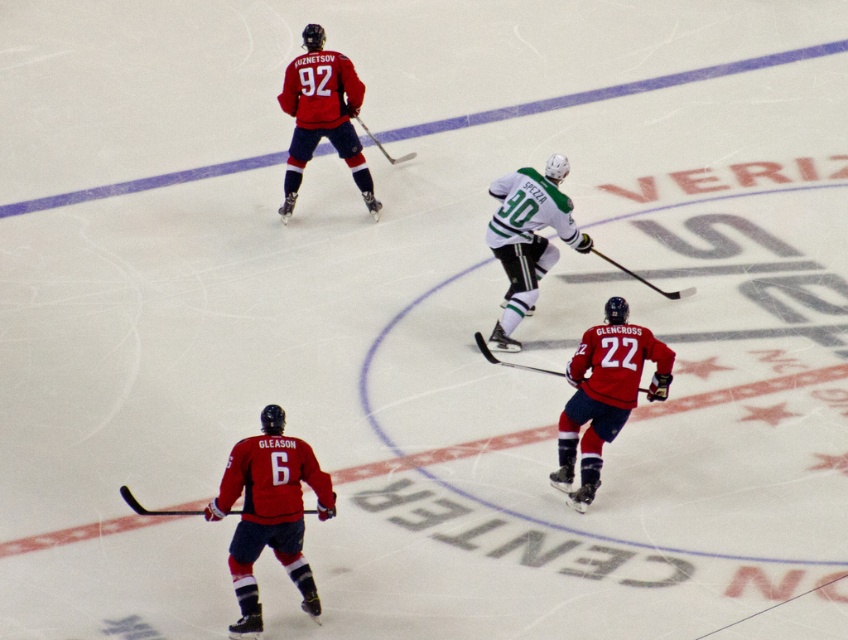
Is black glossy hockey stick at center bigger than matte black hockey stick at upper center?

Incorrect, black glossy hockey stick at center is not larger than matte black hockey stick at upper center.

What do you see at coordinates (646, 280) in the screenshot?
I see `black glossy hockey stick at center` at bounding box center [646, 280].

Locate an element on the screen. black glossy hockey stick at center is located at coordinates (646, 280).

Does point (261, 480) come behind point (556, 192)?

No, (261, 480) is closer to viewer.

Measure the distance from matte red jersey at lower left to white matte jersey at center.

matte red jersey at lower left is 11.26 feet away from white matte jersey at center.

Identify the location of matte red jersey at lower left. The image size is (848, 640). (269, 513).

Does matte red jersey at lower left lie behind red jersey at center?

That is False.

Between point (243, 560) and point (590, 342), which one is positioned behind?

The point (590, 342) is behind.

The height and width of the screenshot is (640, 848). In order to click on matte red jersey at lower left in this screenshot , I will do `click(269, 513)`.